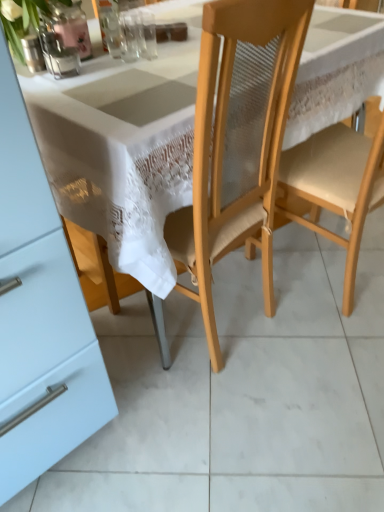
This screenshot has width=384, height=512. I want to click on free spot to the right of clear glass vase at upper center, the second tableware from the right, so click(164, 42).